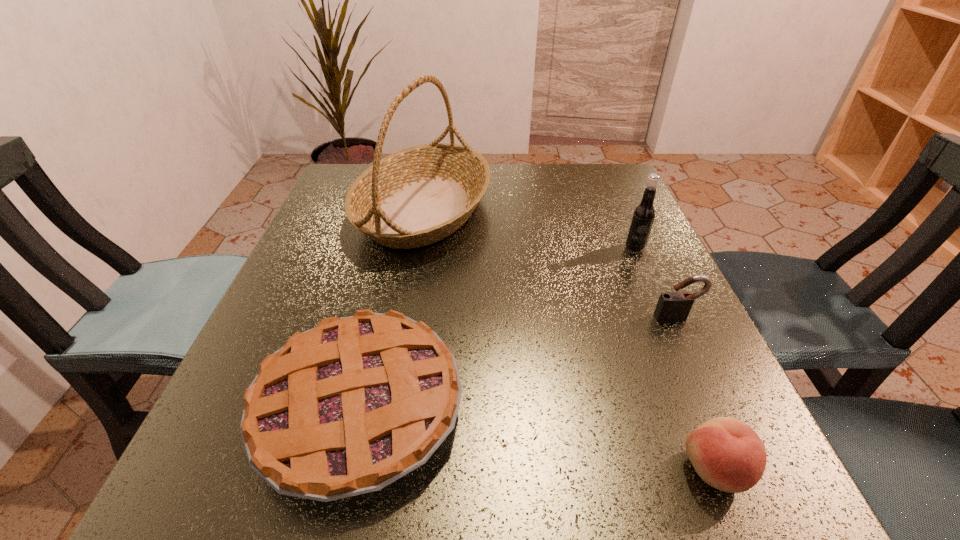
Where is `free space between the third farthest object and the root beer`? free space between the third farthest object and the root beer is located at coordinates (656, 283).

Find the location of `vacant area that lies between the peach and the tallest object`. vacant area that lies between the peach and the tallest object is located at coordinates (569, 339).

At what (x,y) coordinates should I click in order to perform the action: click on free space between the shortest object and the peach. Please return your answer as a coordinate pair (x, y). Image resolution: width=960 pixels, height=540 pixels. Looking at the image, I should click on (538, 438).

At what (x,y) coordinates should I click in order to perform the action: click on empty location between the padlock and the shortest object. Please return your answer as a coordinate pair (x, y). Looking at the image, I should click on (518, 362).

The height and width of the screenshot is (540, 960). In order to click on free spot between the third nearest object and the basket in this screenshot , I will do `click(550, 263)`.

Find the location of a particular element. empty space that is in between the tallest object and the pie is located at coordinates (392, 308).

Locate an element on the screen. unoccupied area between the third tallest object and the shortest object is located at coordinates (518, 362).

The width and height of the screenshot is (960, 540). I want to click on free space between the third shortest object and the root beer, so click(x=656, y=283).

The image size is (960, 540). What are the coordinates of `empty location between the shortest object and the peach` in the screenshot? It's located at (538, 438).

Identify which object is located as the fourth nearest to the root beer. Please provide its 2D coordinates. Your answer should be formatted as a tuple, i.e. [(x, y)], where the tuple contains the x and y coordinates of a point satisfying the conditions above.

[(727, 454)]